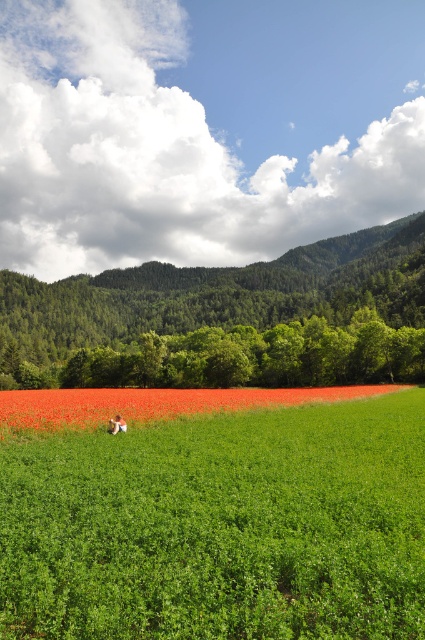
Which is more to the right, green forested mountain at center or light brown hair at center?

light brown hair at center

Between point (331, 380) and point (115, 420), which one is positioned behind?

The point (331, 380) is more distant.

Locate an element on the screen. The height and width of the screenshot is (640, 425). green forested mountain at center is located at coordinates (227, 320).

Does green forested mountain at center have a greater width compared to bright red petals at center?

Indeed, green forested mountain at center has a greater width compared to bright red petals at center.

Which is behind, point (229, 298) or point (197, 413)?

Positioned behind is point (229, 298).

The height and width of the screenshot is (640, 425). I want to click on green forested mountain at center, so click(227, 320).

Does green grassy field at center have a greater height compared to bright red petals at center?

No, green grassy field at center is not taller than bright red petals at center.

Can you confirm if green grassy field at center is shorter than bright red petals at center?

Correct, green grassy field at center is not as tall as bright red petals at center.

Who is more forward, (235, 445) or (201, 388)?

Point (235, 445)

This screenshot has height=640, width=425. I want to click on green grassy field at center, so click(220, 525).